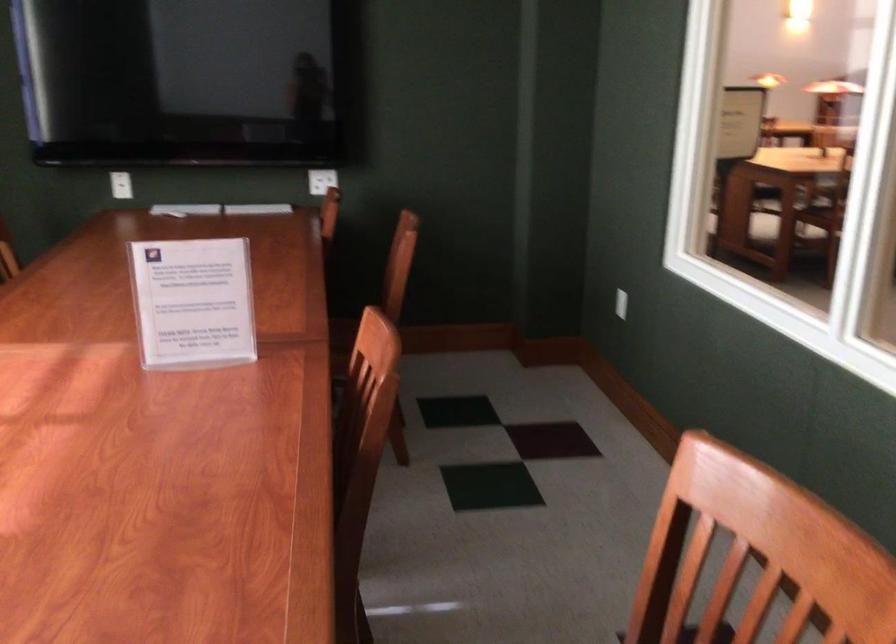
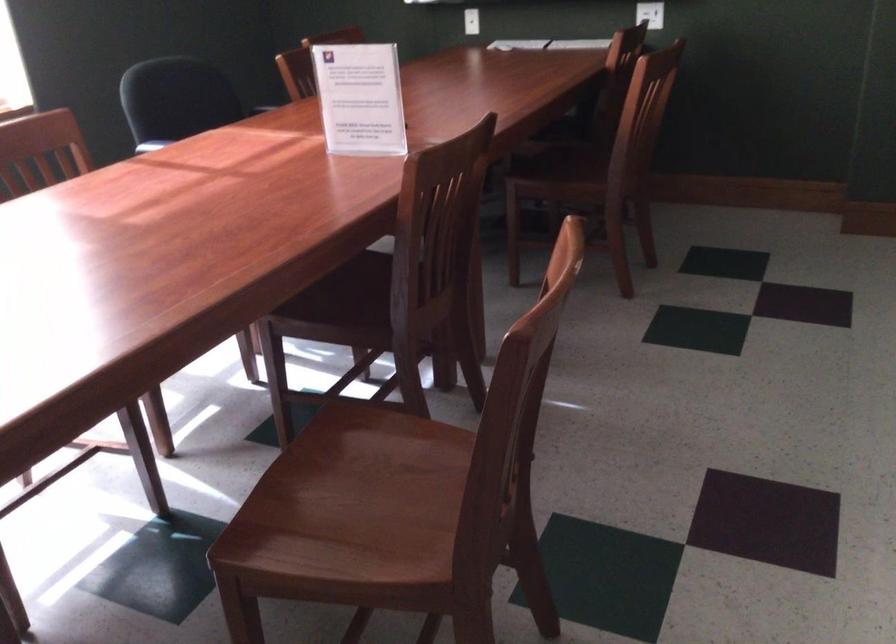
Find the pixel in the second image that matches pixel 130 185 in the first image.

(471, 21)